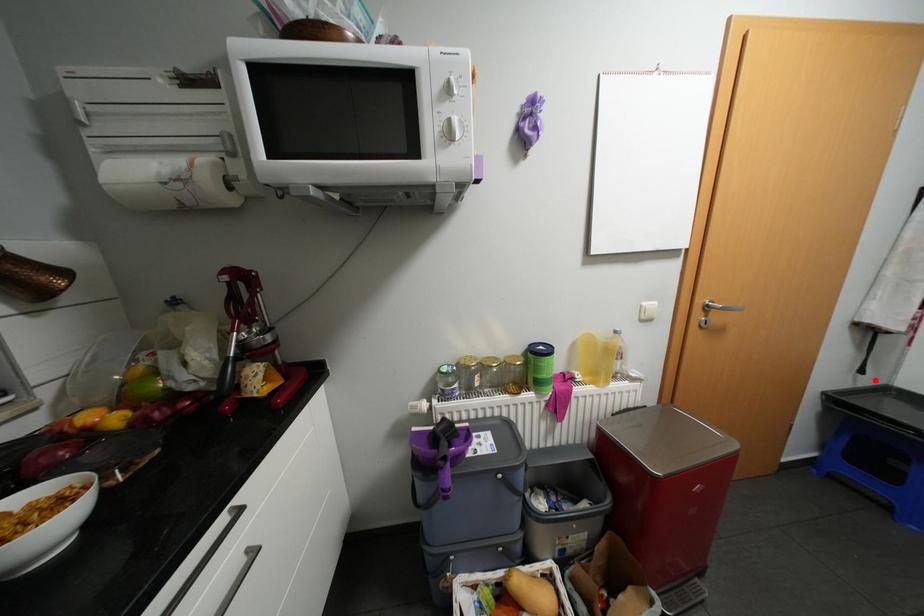
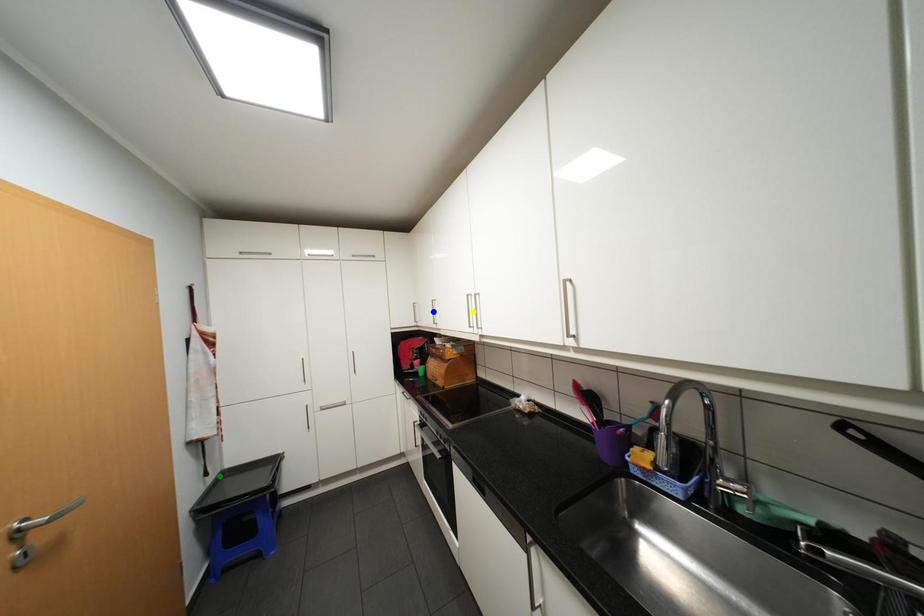
Question: I am providing you with two images of the same scene from different viewpoints. A red point is marked on the first image. You are given multiple points on the second image. In image 2, which mark is for the same physical point as the one in image 1?

Choices:
 (A) yellow point
 (B) green point
 (C) blue point

Answer: (B)